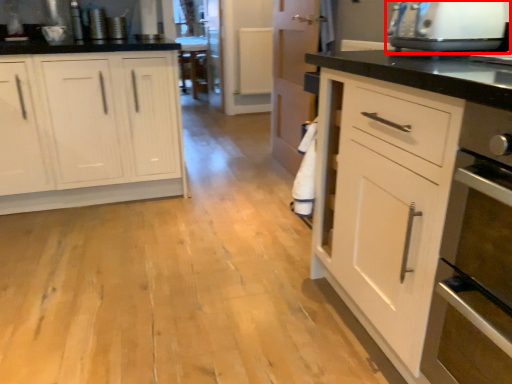
Question: Observing the image, what is the correct spatial positioning of home appliance (annotated by the red box) in reference to cabinetry?

Choices:
 (A) left
 (B) right

Answer: (B)